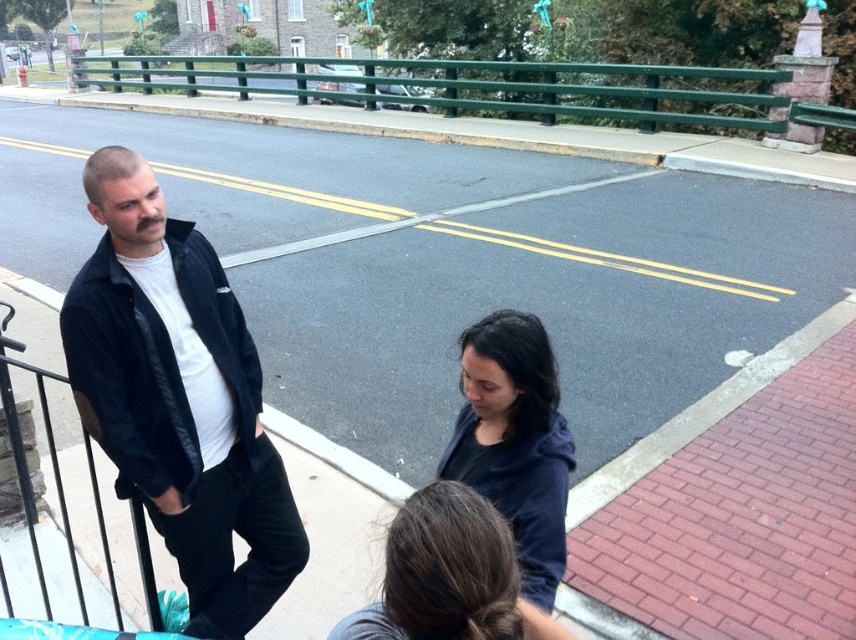
Question: Where is green painted metal railing at upper center located in relation to dark brown hair at lower center in the image?

Choices:
 (A) left
 (B) right

Answer: (A)

Question: Which object appears farthest from the camera in this image?

Choices:
 (A) dark blue hoodie at center
 (B) green painted metal railing at upper center

Answer: (B)

Question: Which object is the closest to the dark blue hoodie at center?

Choices:
 (A) dark brown hair at lower center
 (B) green painted metal railing at upper center
 (C) black leather jacket at left

Answer: (A)

Question: Which point is closer to the camera taking this photo?

Choices:
 (A) (432, 548)
 (B) (253, 579)
 (C) (494, 432)

Answer: (A)

Question: Does green painted metal railing at upper center appear over dark brown hair at lower center?

Choices:
 (A) no
 (B) yes

Answer: (B)

Question: Is black leather jacket at left to the right of green painted metal railing at upper center from the viewer's perspective?

Choices:
 (A) yes
 (B) no

Answer: (A)